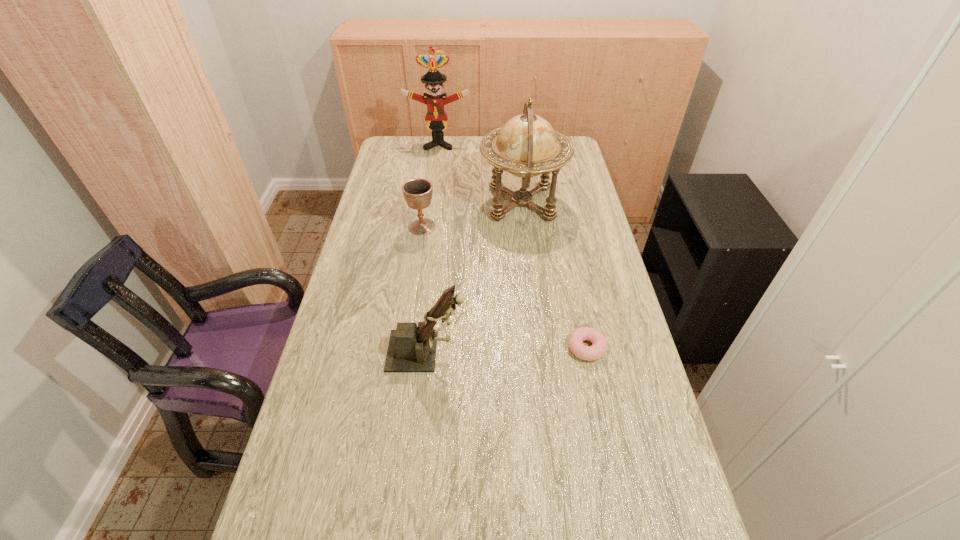
Select which object is the fourth closest to the shortest object. Please provide its 2D coordinates. Your answer should be formatted as a tuple, i.e. [(x, y)], where the tuple contains the x and y coordinates of a point satisfying the conditions above.

[(436, 116)]

Locate which object is the second closest to the second shortest object. Please provide its 2D coordinates. Your answer should be formatted as a tuple, i.e. [(x, y)], where the tuple contains the x and y coordinates of a point satisfying the conditions above.

[(411, 349)]

At what (x,y) coordinates should I click in order to perform the action: click on vacant space that satisfies the following two spatial constraints: 1. on the front side of the doughnut; 2. on the front-facing side of the figurine. Please return your answer as a coordinate pair (x, y). Looking at the image, I should click on (588, 351).

Where is `vacant space that satisfies the following two spatial constraints: 1. on the front-facing side of the nutcracker; 2. on the left side of the doughnut`? The height and width of the screenshot is (540, 960). vacant space that satisfies the following two spatial constraints: 1. on the front-facing side of the nutcracker; 2. on the left side of the doughnut is located at coordinates (412, 348).

I want to click on vacant point that satisfies the following two spatial constraints: 1. on the front-facing side of the nutcracker; 2. on the left side of the shortest object, so click(x=412, y=348).

At what (x,y) coordinates should I click in order to perform the action: click on free spot that satisfies the following two spatial constraints: 1. on the back side of the doughnut; 2. on the front-facing side of the globe. Please return your answer as a coordinate pair (x, y). The image size is (960, 540). Looking at the image, I should click on (557, 203).